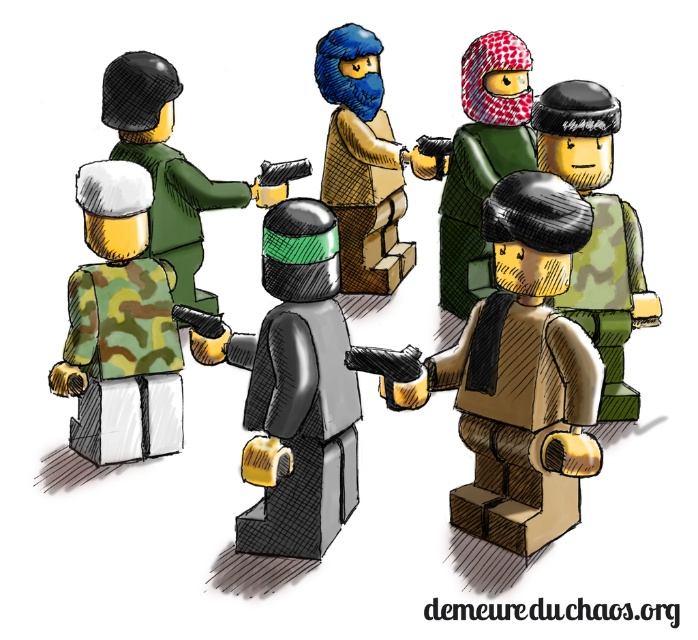
Does camouflage fabric figure at left appear on the left side of brown matte/wooden block at center?

Indeed, camouflage fabric figure at left is positioned on the left side of brown matte/wooden block at center.

Who is more forward, [107,204] or [329,176]?

Point [107,204] is in front.

Is point (77, 323) in front of point (359, 205)?

Yes.

Identify the location of camouflage fabric figure at left. (119, 326).

Who is lower down, brown matte vest at center or patterned fabric mask at center?

Positioned lower is brown matte vest at center.

You are a GUI agent. You are given a task and a screenshot of the screen. Output one action in this format:
    pyautogui.click(x=<x>, y=<y>)
    Task: Click on the brown matte vest at center
    The image size is (698, 640).
    Given the screenshot: What is the action you would take?
    pyautogui.click(x=521, y=372)

In the scene shown: Who is more distant from viewer, (x=385, y=257) or (x=181, y=244)?

The point (x=385, y=257) is more distant.

Between brown matte/wooden block at center and matte green helmet at center, which one is positioned lower?

matte green helmet at center

Where is `brown matte/wooden block at center`? This screenshot has height=640, width=698. brown matte/wooden block at center is located at coordinates (363, 163).